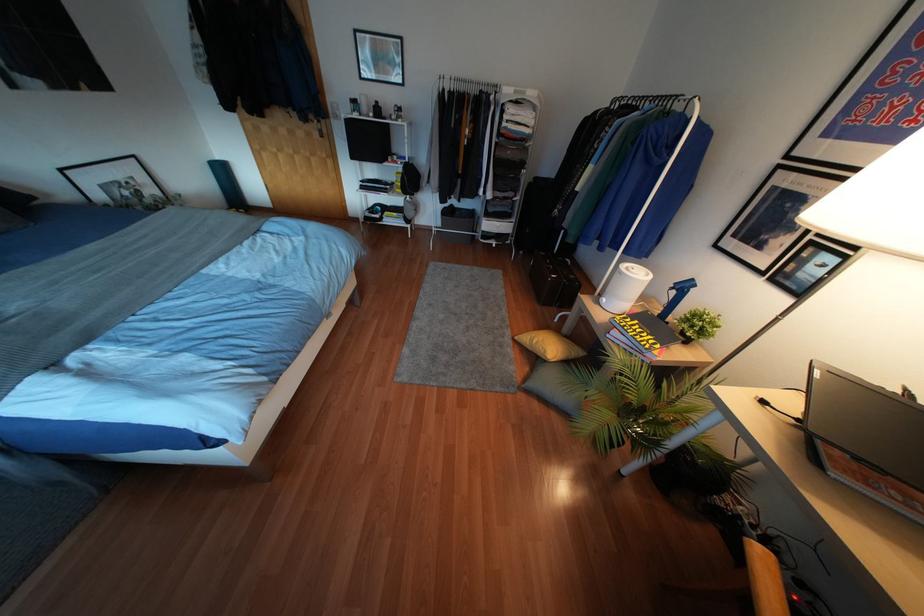
Identify the location of white air humidifier. This screenshot has height=616, width=924. (625, 286).